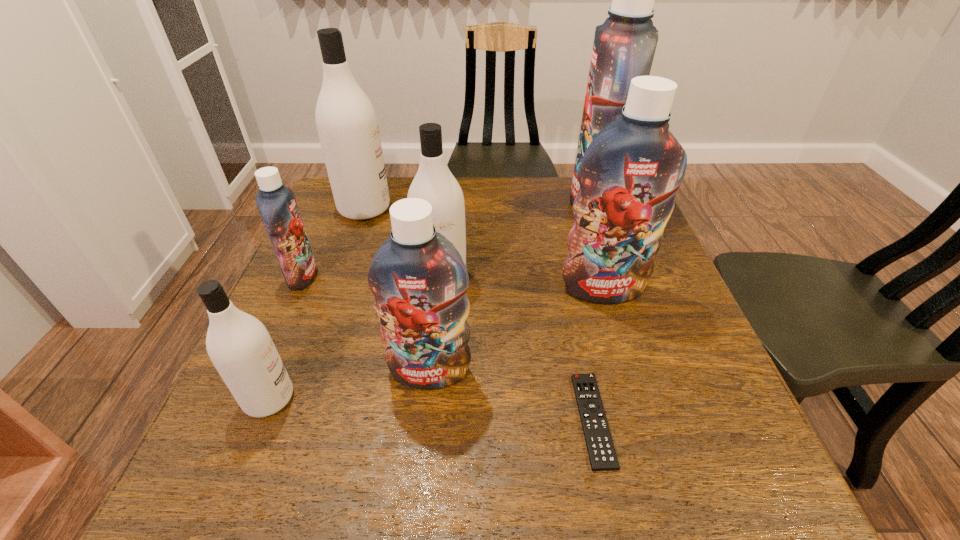
You are a GUI agent. You are given a task and a screenshot of the screen. Output one action in this format:
    pyautogui.click(x=<x>, y=<y>)
    Task: Click on the biggest blue shampoo
    The image size is (960, 540).
    Given the screenshot: What is the action you would take?
    pyautogui.click(x=624, y=45)

Locate an element on the screen. The height and width of the screenshot is (540, 960). the tallest object is located at coordinates point(624,45).

Identify the location of the farthest white shampoo. This screenshot has height=540, width=960. (346, 121).

At what (x,y) coordinates should I click in order to perform the action: click on the second biggest blue shampoo. Please return your answer as a coordinate pair (x, y). The image size is (960, 540). Looking at the image, I should click on (629, 175).

In order to click on the rightmost white shampoo in this screenshot , I will do `click(434, 182)`.

I want to click on the second nearest white shampoo, so click(x=434, y=182).

Where is `the third biggest blue shampoo`? The width and height of the screenshot is (960, 540). the third biggest blue shampoo is located at coordinates (419, 280).

This screenshot has width=960, height=540. In order to click on the nearest blue shampoo in this screenshot , I will do `click(419, 280)`.

The height and width of the screenshot is (540, 960). What are the coordinates of `the leftmost blue shampoo` in the screenshot? It's located at (277, 205).

Locate an element on the screen. The height and width of the screenshot is (540, 960). the nearest white shampoo is located at coordinates (239, 345).